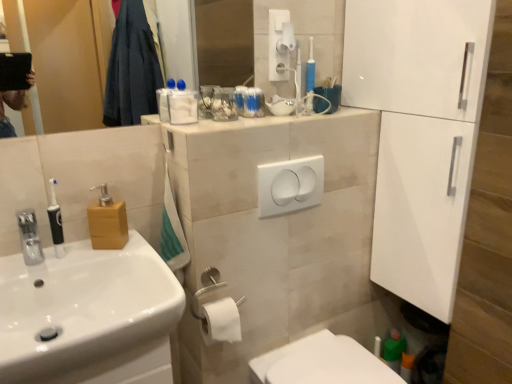
Question: Is white plastic hand dryer at upper center bigger than black rubberized toothbrush at left, the 1th toiletry from the bottom?

Choices:
 (A) yes
 (B) no

Answer: (B)

Question: Is white plastic hand dryer at upper center at the left side of black rubberized toothbrush at left, which appears as the second toiletry when viewed from the back?

Choices:
 (A) no
 (B) yes

Answer: (A)

Question: Are white plastic hand dryer at upper center and black rubberized toothbrush at left, the 1th toiletry from the bottom, making contact?

Choices:
 (A) yes
 (B) no

Answer: (B)

Question: From the image's perspective, does white plastic hand dryer at upper center appear higher than black rubberized toothbrush at left, which is the 2th toiletry from top to bottom?

Choices:
 (A) yes
 (B) no

Answer: (A)

Question: Is white plastic hand dryer at upper center looking in the opposite direction of black rubberized toothbrush at left, arranged as the first toiletry when viewed from the left?

Choices:
 (A) yes
 (B) no

Answer: (B)

Question: Considering their positions, is white matte toilet paper at upper center, positioned as the 2th toilet paper in bottom-to-top order, located in front of or behind translucent plastic toothbrushes at upper center, the 1th toiletry in the right-to-left sequence?

Choices:
 (A) behind
 (B) front

Answer: (A)

Question: Is point (285, 36) positioned closer to the camera than point (260, 97)?

Choices:
 (A) closer
 (B) farther

Answer: (B)

Question: Is white matte toilet paper at upper center, which appears as the first toilet paper when viewed from the back, inside or outside of translucent plastic toothbrushes at upper center, arranged as the second toiletry when viewed from the left?

Choices:
 (A) outside
 (B) inside

Answer: (A)

Question: From a real-world perspective, is white matte toilet paper at upper center, which appears as the first toilet paper when viewed from the back, positioned above or below translucent plastic toothbrushes at upper center, the 1th toiletry in the right-to-left sequence?

Choices:
 (A) above
 (B) below

Answer: (A)

Question: From a real-world perspective, is wooden soap dispenser at left physically located above or below satin silver toilet paper holder at lower center?

Choices:
 (A) below
 (B) above

Answer: (B)

Question: From the image's perspective, relative to satin silver toilet paper holder at lower center, is wooden soap dispenser at left above or below?

Choices:
 (A) above
 (B) below

Answer: (A)

Question: Choose the correct answer: Is wooden soap dispenser at left inside satin silver toilet paper holder at lower center or outside it?

Choices:
 (A) inside
 (B) outside

Answer: (B)

Question: Is wooden soap dispenser at left taller or shorter than satin silver toilet paper holder at lower center?

Choices:
 (A) short
 (B) tall

Answer: (B)

Question: From a real-world perspective, relative to white matte toilet paper at upper center, the 1th toilet paper in the right-to-left sequence, is white glossy cabinet at right vertically above or below?

Choices:
 (A) above
 (B) below

Answer: (B)

Question: From the image's perspective, is white glossy cabinet at right above or below white matte toilet paper at upper center, the 1th toilet paper in the right-to-left sequence?

Choices:
 (A) above
 (B) below

Answer: (B)